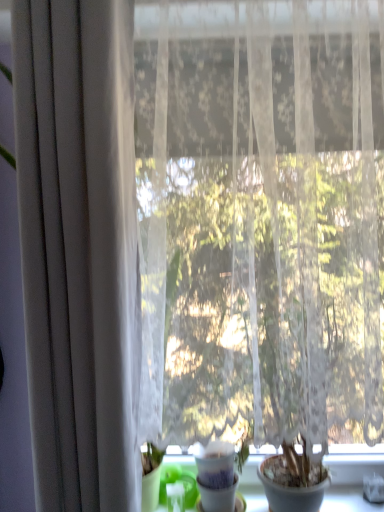
Describe the element at coordinates (292, 486) in the screenshot. This screenshot has height=512, width=384. I see `matte white flowerpot at lower right` at that location.

Identify the location of matte gray curtain at left. The image size is (384, 512). (79, 249).

This screenshot has width=384, height=512. There is a green plastic at lower left. In order to click on curtain above it (from a real-world perspective) in this screenshot , I will do `click(79, 249)`.

From a real-world perspective, which is physically below, matte gray curtain at left or green plastic at lower left?

green plastic at lower left, from a real-world perspective.

From the image's perspective, which one is positioned higher, matte gray curtain at left or green plastic at lower left?

matte gray curtain at left.

Between matte gray curtain at left and green plastic at lower left, which one has larger width?

green plastic at lower left.

Between green plastic at lower left and matte gray curtain at left, which one has less height?

Standing shorter between the two is green plastic at lower left.

Is green plastic at lower left oriented away from matte gray curtain at left?

No, green plastic at lower left is not facing the opposite direction of matte gray curtain at left.

From the image's perspective, is green plastic at lower left located above or below matte gray curtain at left?

Based on their image positions, green plastic at lower left is located beneath matte gray curtain at left.

Considering the sizes of objects green plastic at lower left and matte gray curtain at left in the image provided, who is smaller, green plastic at lower left or matte gray curtain at left?

green plastic at lower left.

From the image's perspective, which is below, green plastic at lower left or white matte pot at center?

green plastic at lower left, from the image's perspective.

Looking at their sizes, would you say green plastic at lower left is wider or thinner than white matte pot at center?

Considering their sizes, green plastic at lower left looks broader than white matte pot at center.

Is green plastic at lower left facing towards white matte pot at center?

No, green plastic at lower left is not turned towards white matte pot at center.

Could you tell me if white matte pot at center is turned towards matte white flowerpot at lower right?

No, white matte pot at center is not aimed at matte white flowerpot at lower right.

From a real-world perspective, is white matte pot at center on matte white flowerpot at lower right?

Actually, white matte pot at center is physically below matte white flowerpot at lower right in the real world.

Does point (198, 470) come closer to viewer compared to point (285, 461)?

No, it is behind (285, 461).

Based on their sizes in the image, would you say white matte pot at center is bigger or smaller than matte white flowerpot at lower right?

Clearly, white matte pot at center is smaller in size than matte white flowerpot at lower right.

Considering the sizes of matte white flowerpot at lower right and green plastic at lower left in the image, is matte white flowerpot at lower right taller or shorter than green plastic at lower left?

→ Considering their sizes, matte white flowerpot at lower right has more height than green plastic at lower left.

Is matte white flowerpot at lower right not close to green plastic at lower left?

matte white flowerpot at lower right is near green plastic at lower left, not far away.

Considering the positions of objects matte white flowerpot at lower right and green plastic at lower left in the image provided, who is more to the left, matte white flowerpot at lower right or green plastic at lower left?

green plastic at lower left is more to the left.

At what (x,y) coordinates should I click in order to perform the action: click on flowerpot on the right of green plastic at lower left. Please return your answer as a coordinate pair (x, y). The height and width of the screenshot is (512, 384). Looking at the image, I should click on (292, 486).

Does matte white flowerpot at lower right contain matte gray curtain at left?

No, matte gray curtain at left is not surrounded by matte white flowerpot at lower right.

How many degrees apart are the facing directions of matte white flowerpot at lower right and matte gray curtain at left?

0.0013 degrees separate the facing orientations of matte white flowerpot at lower right and matte gray curtain at left.

Measure the distance from matte white flowerpot at lower right to matte gray curtain at left.

matte white flowerpot at lower right is 27.38 inches from matte gray curtain at left.

Which object is wider, matte white flowerpot at lower right or matte gray curtain at left?

matte white flowerpot at lower right.

Does matte gray curtain at left lie behind white matte pot at center?

No, matte gray curtain at left is in front of white matte pot at center.

Which is less distant, (x=71, y=481) or (x=224, y=492)?

Point (x=71, y=481) is closer to the camera than point (x=224, y=492).

At what (x,y) coordinates should I click in order to perform the action: click on houseplant below the matte gray curtain at left (from the image's perspective). Please return your answer as a coordinate pair (x, y). The image size is (384, 512). Looking at the image, I should click on (217, 476).

Which object is positioned more to the right, matte gray curtain at left or white matte pot at center?

Result: white matte pot at center.

This screenshot has width=384, height=512. Identify the location of window sill to the right of matte gray curtain at left. (352, 473).

Locate an element on the screen. This screenshot has width=384, height=512. window sill below the matte gray curtain at left (from the image's perspective) is located at coordinates (352, 473).

Which object lies nearer to the anchor point matte white flowerpot at lower right, white matte pot at center or matte gray curtain at left?

white matte pot at center lies closer to matte white flowerpot at lower right than the other object.

Considering their positions, is matte gray curtain at left positioned further to green plastic at lower left than white matte pot at center?

Among the two, matte gray curtain at left is located further to green plastic at lower left.

Looking at the image, which one is located further to white matte pot at center, matte white flowerpot at lower right or matte gray curtain at left?

Based on the image, matte gray curtain at left appears to be further to white matte pot at center.

Which object lies further to the anchor point matte white flowerpot at lower right, matte gray curtain at left or green plastic at lower left?

matte gray curtain at left is positioned further to the anchor matte white flowerpot at lower right.

Which object lies nearer to the anchor point matte gray curtain at left, green plastic at lower left or matte white flowerpot at lower right?

The object closer to matte gray curtain at left is green plastic at lower left.

Considering their positions, is green plastic at lower left positioned closer to matte white flowerpot at lower right than matte gray curtain at left?

green plastic at lower left.

When comparing their distances from green plastic at lower left, does white matte pot at center or matte white flowerpot at lower right seem closer?

matte white flowerpot at lower right is positioned closer to the anchor green plastic at lower left.

Which object lies nearer to the anchor point matte gray curtain at left, green plastic at lower left or white matte pot at center?

The object closer to matte gray curtain at left is white matte pot at center.

Find the location of a particular element. The width and height of the screenshot is (384, 512). houseplant between matte gray curtain at left and green plastic at lower left vertically is located at coordinates (217, 476).

The width and height of the screenshot is (384, 512). In order to click on window sill situated between white matte pot at center and matte white flowerpot at lower right from left to right in this screenshot , I will do `click(352, 473)`.

The width and height of the screenshot is (384, 512). I want to click on flowerpot between matte gray curtain at left and white matte pot at center vertically, so click(x=292, y=486).

Where is `flowerpot between matte gray curtain at left and green plastic at lower left in the vertical direction`? flowerpot between matte gray curtain at left and green plastic at lower left in the vertical direction is located at coordinates (292, 486).